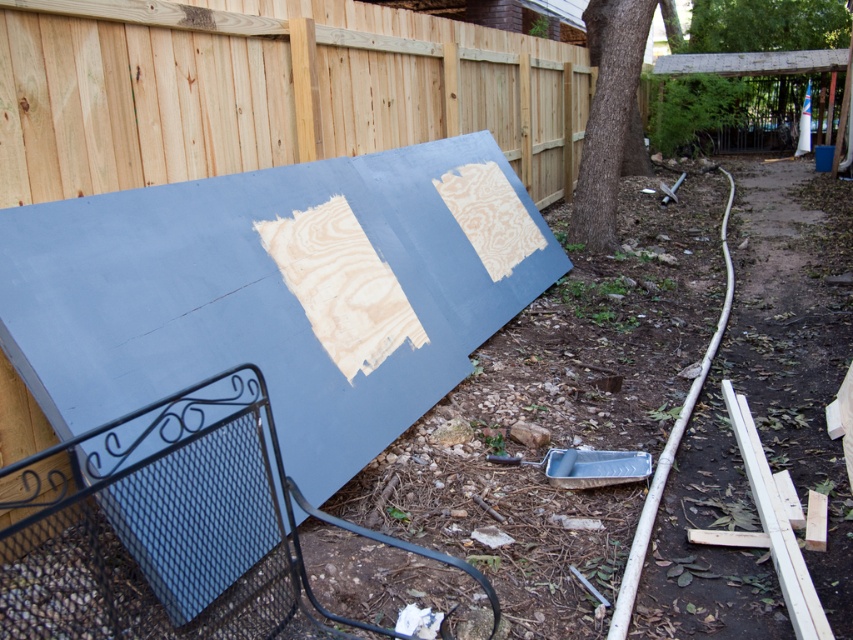
You are a gardener planning to plant a new flower bed between the brown rough bark tree at center and the green wood tree at upper center. Which tree should you place the flowers closer to if you want them to be near the smaller tree?

The brown rough bark tree at center is smaller than the green wood tree at upper center, so you should place the flowers closer to the brown rough bark tree at center.

You are a gardener planning to plant a new flower bed between the brown rough bark tree at center and the green wood tree at upper center. Based on their positions, which tree should you place the flowers closer to?

The brown rough bark tree at center is located below the green wood tree at upper center, so you should place the flowers closer to the brown rough bark tree at center since it is lower and the green wood tree at upper center is positioned higher.